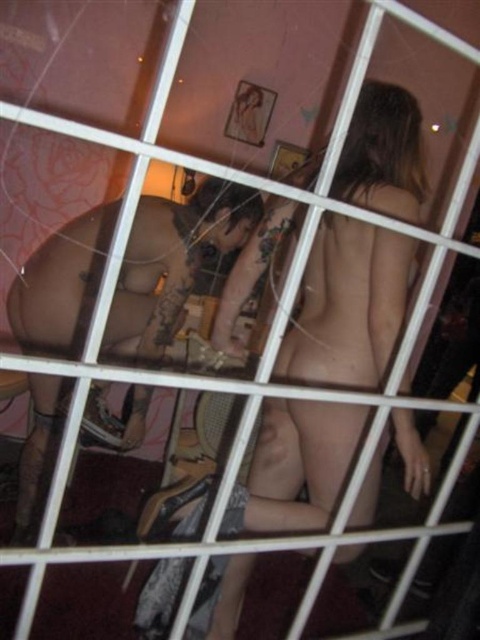
Can you confirm if smooth skin man at center is shorter than black matte underwear at lower center?

Incorrect, smooth skin man at center's height does not fall short of black matte underwear at lower center's.

Which is in front, point (172, 268) or point (212, 496)?

Point (212, 496) is in front.

Who is more distant from viewer, (139, 344) or (136, 621)?

The point (139, 344) is behind.

I want to click on smooth skin man at center, so click(173, 259).